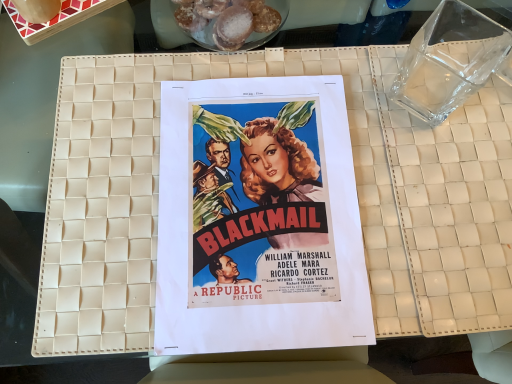
Question: From the image's perspective, is sugared doughnuts at upper center on top of matte paper poster at center?

Choices:
 (A) no
 (B) yes

Answer: (B)

Question: Does sugared doughnuts at upper center turn towards matte paper poster at center?

Choices:
 (A) no
 (B) yes

Answer: (B)

Question: Is matte paper poster at center at the back of sugared doughnuts at upper center?

Choices:
 (A) no
 (B) yes

Answer: (A)

Question: Is sugared doughnuts at upper center in contact with matte paper poster at center?

Choices:
 (A) yes
 (B) no

Answer: (B)

Question: Can you confirm if sugared doughnuts at upper center is smaller than matte paper poster at center?

Choices:
 (A) no
 (B) yes

Answer: (B)

Question: Is the position of sugared doughnuts at upper center more distant than that of matte paper poster at center?

Choices:
 (A) no
 (B) yes

Answer: (B)

Question: From a real-world perspective, does matte paper poster at center sit lower than sugared doughnuts at upper center?

Choices:
 (A) no
 (B) yes

Answer: (B)

Question: Is matte paper poster at center taller than sugared doughnuts at upper center?

Choices:
 (A) no
 (B) yes

Answer: (A)

Question: Considering the relative sizes of matte paper poster at center and sugared doughnuts at upper center in the image provided, is matte paper poster at center smaller than sugared doughnuts at upper center?

Choices:
 (A) no
 (B) yes

Answer: (A)

Question: Considering the relative sizes of matte paper poster at center and sugared doughnuts at upper center in the image provided, is matte paper poster at center shorter than sugared doughnuts at upper center?

Choices:
 (A) no
 (B) yes

Answer: (B)

Question: Can you confirm if matte paper poster at center is bigger than sugared doughnuts at upper center?

Choices:
 (A) yes
 (B) no

Answer: (A)

Question: Considering the relative sizes of matte paper poster at center and sugared doughnuts at upper center in the image provided, is matte paper poster at center thinner than sugared doughnuts at upper center?

Choices:
 (A) no
 (B) yes

Answer: (A)

Question: Based on their sizes in the image, would you say sugared doughnuts at upper center is bigger or smaller than matte paper poster at center?

Choices:
 (A) small
 (B) big

Answer: (A)